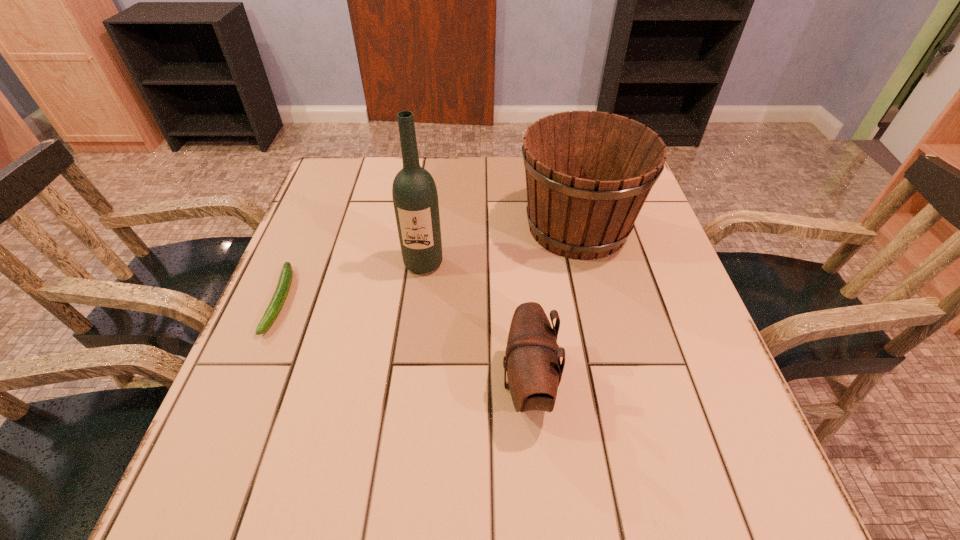
Where is `the tallest object`? The height and width of the screenshot is (540, 960). the tallest object is located at coordinates (415, 198).

You are a GUI agent. You are given a task and a screenshot of the screen. Output one action in this format:
    pyautogui.click(x=<x>, y=<y>)
    Task: Click on the third object from right to left
    Image resolution: width=960 pixels, height=540 pixels.
    Given the screenshot: What is the action you would take?
    pyautogui.click(x=415, y=198)

Locate an element on the screen. This screenshot has width=960, height=540. wine bucket is located at coordinates (588, 174).

I want to click on the nearest object, so click(534, 371).

Image resolution: width=960 pixels, height=540 pixels. What are the coordinates of `pouch` in the screenshot? It's located at (534, 371).

Where is `the leftmost object`? This screenshot has height=540, width=960. the leftmost object is located at coordinates (286, 275).

The image size is (960, 540). I want to click on zucchini, so click(286, 275).

Identify the location of vacant space located on the labeled side of the wine bottle. click(x=417, y=316).

Where is `blank space located 0.290m on the left of the third shortest object`? The image size is (960, 540). blank space located 0.290m on the left of the third shortest object is located at coordinates (400, 227).

This screenshot has width=960, height=540. I want to click on vacant area situated 0.100m with the flap open on the third tallest object, so click(x=445, y=386).